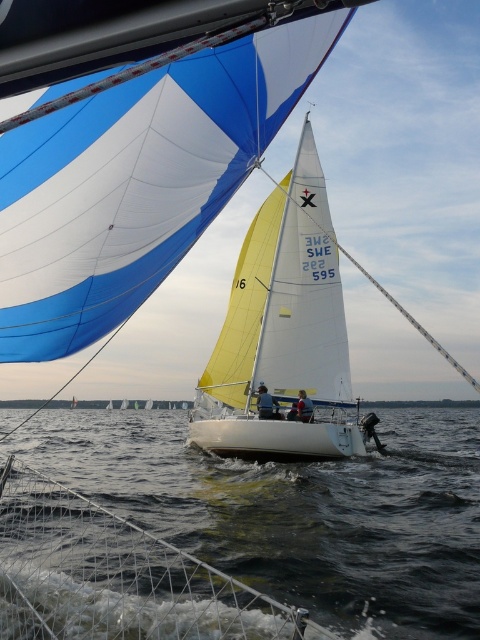
Question: Observing the image, what is the correct spatial positioning of dark blue water at lower center in reference to white matte sailboat at center?

Choices:
 (A) right
 (B) left

Answer: (B)

Question: Can you confirm if dark blue water at lower center is thinner than white matte sailboat at center?

Choices:
 (A) yes
 (B) no

Answer: (B)

Question: Which of the following is the farthest from the observer?

Choices:
 (A) white matte sailboat at center
 (B) dark blue water at lower center

Answer: (A)

Question: Considering the relative positions of dark blue water at lower center and white matte sailboat at center in the image provided, where is dark blue water at lower center located with respect to white matte sailboat at center?

Choices:
 (A) above
 (B) below

Answer: (B)

Question: Which of the following is the farthest from the observer?

Choices:
 (A) (38, 417)
 (B) (296, 204)

Answer: (A)

Question: Which object is closer to the camera taking this photo?

Choices:
 (A) dark blue water at lower center
 (B) white matte sailboat at center

Answer: (A)